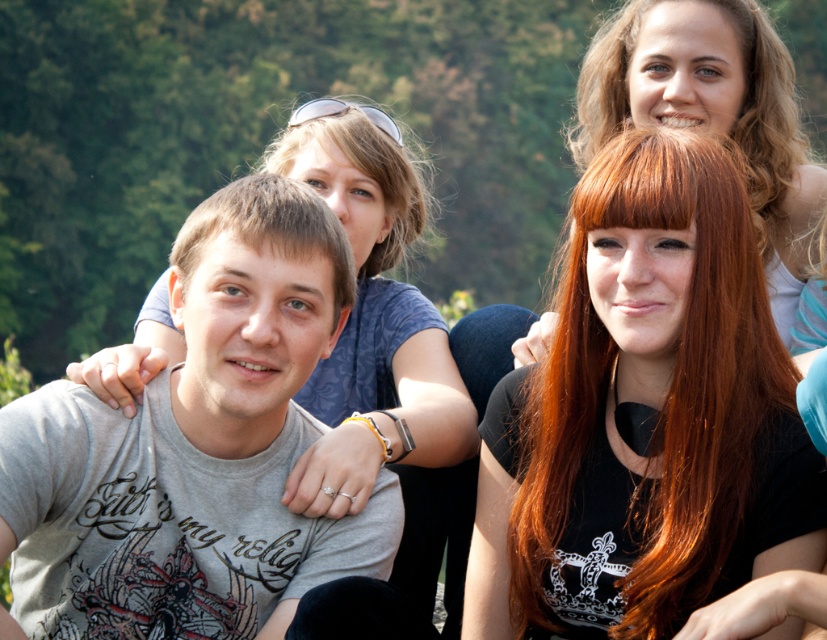
Does curly blonde hair at upper right appear over brown matte hair at center?

Yes, curly blonde hair at upper right is above brown matte hair at center.

Is curly blonde hair at upper right to the right of brown matte hair at center from the viewer's perspective?

Yes, curly blonde hair at upper right is to the right of brown matte hair at center.

Between point (744, 102) and point (216, 205), which one is positioned behind?

Positioned behind is point (744, 102).

Locate an element on the screen. Image resolution: width=827 pixels, height=640 pixels. curly blonde hair at upper right is located at coordinates tap(765, 113).

Between gray cotton t-shirt at left and brown matte hair at center, which one appears on the left side from the viewer's perspective?

gray cotton t-shirt at left

Does gray cotton t-shirt at left appear on the left side of brown matte hair at center?

Yes, gray cotton t-shirt at left is to the left of brown matte hair at center.

Is point (123, 454) positioned after point (324, 234)?

No, it is in front of (324, 234).

The height and width of the screenshot is (640, 827). Find the location of `gray cotton t-shirt at left`. gray cotton t-shirt at left is located at coordinates (194, 449).

Can you confirm if shiny red hair at center is positioned below curly blonde hair at upper right?

Yes, shiny red hair at center is below curly blonde hair at upper right.

Can you confirm if shiny red hair at center is thinner than curly blonde hair at upper right?

Yes, shiny red hair at center is thinner than curly blonde hair at upper right.

Locate an element on the screen. shiny red hair at center is located at coordinates (643, 412).